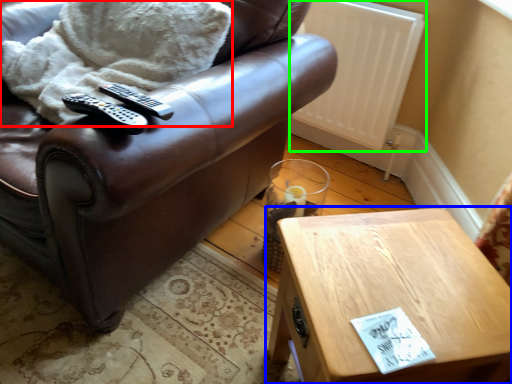
Question: Which object is positioned farthest from blanket (highlighted by a red box)? Select from table (highlighted by a blue box) and radiator (highlighted by a green box).

Choices:
 (A) table
 (B) radiator

Answer: (A)